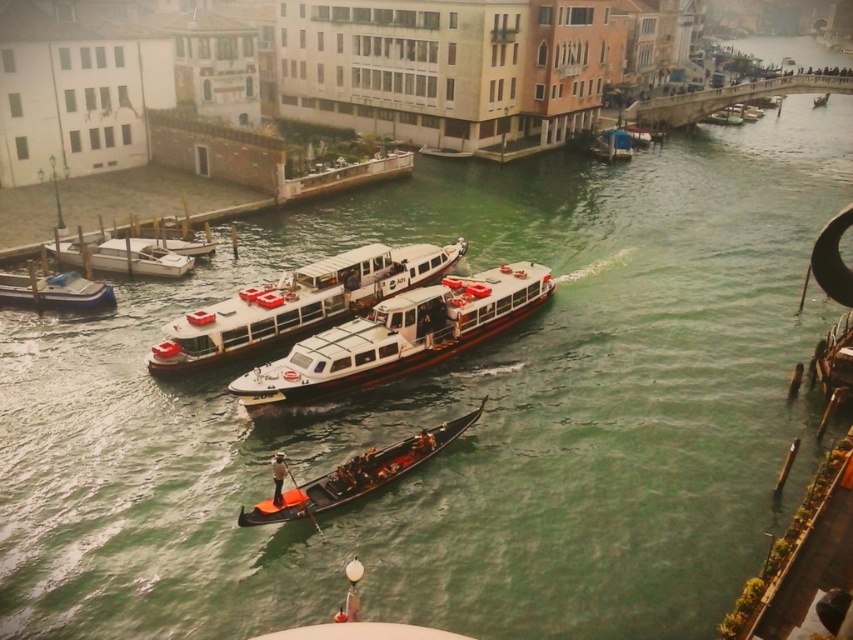
Question: Is wooden polished gondola at center above matte white boat at lower left?

Choices:
 (A) yes
 (B) no

Answer: (B)

Question: Which point is closer to the camera taking this photo?

Choices:
 (A) (599, 147)
 (B) (61, 304)
 (C) (173, 275)
 (D) (370, 282)

Answer: (B)

Question: Is white glossy ferry boat at center closer to camera compared to white glossy boat at left?

Choices:
 (A) yes
 (B) no

Answer: (A)

Question: Based on their relative distances, which object is farther from the white glossy ferry boat at center?

Choices:
 (A) white glossy boat at center
 (B) matte white boat at lower left
 (C) metallic silver boat at upper right

Answer: (C)

Question: Among these objects, which one is farthest from the camera?

Choices:
 (A) white glossy boat at left
 (B) matte white boat at lower left

Answer: (A)

Question: Is white glossy ferry boat at center positioned before metallic silver boat at upper right?

Choices:
 (A) no
 (B) yes

Answer: (B)